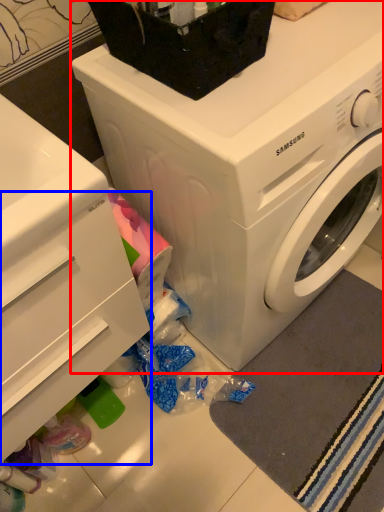
Question: Among these objects, which one is farthest to the camera, washing machine (highlighted by a red box) or drawer (highlighted by a blue box)?

Choices:
 (A) washing machine
 (B) drawer

Answer: (A)